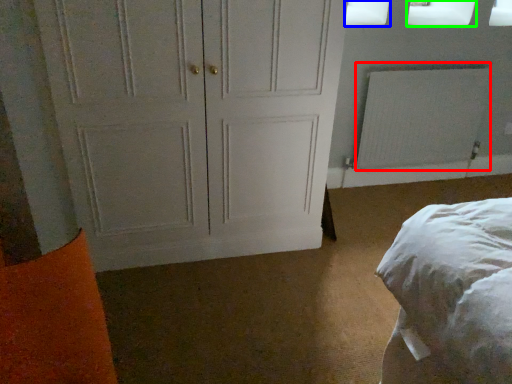
Question: Which object is positioned closest to radiator (highlighted by a red box)? Select from window screen (highlighted by a blue box) and window screen (highlighted by a green box).

Choices:
 (A) window screen
 (B) window screen

Answer: (B)